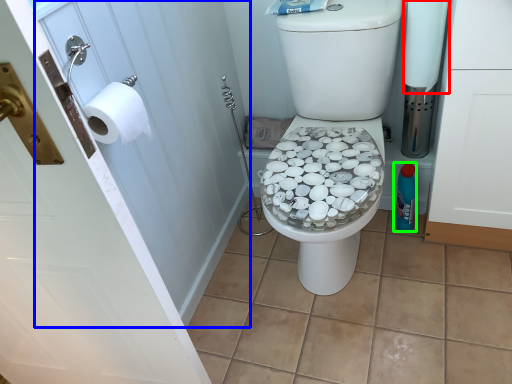
Question: Which is nearer to the toilet paper (highlighted by a red box)? screen door (highlighted by a blue box) or bottle (highlighted by a green box).

Choices:
 (A) screen door
 (B) bottle

Answer: (B)